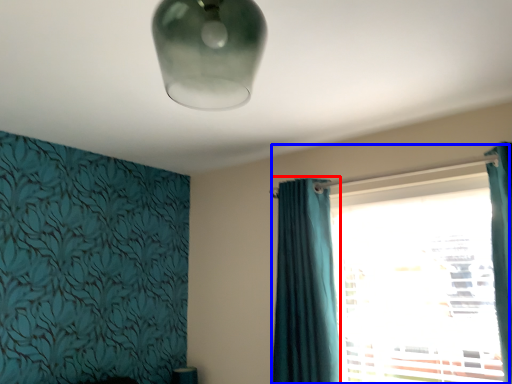
Question: Which of the following is the farthest to the observer, curtain (highlighted by a red box) or window (highlighted by a blue box)?

Choices:
 (A) curtain
 (B) window

Answer: (A)